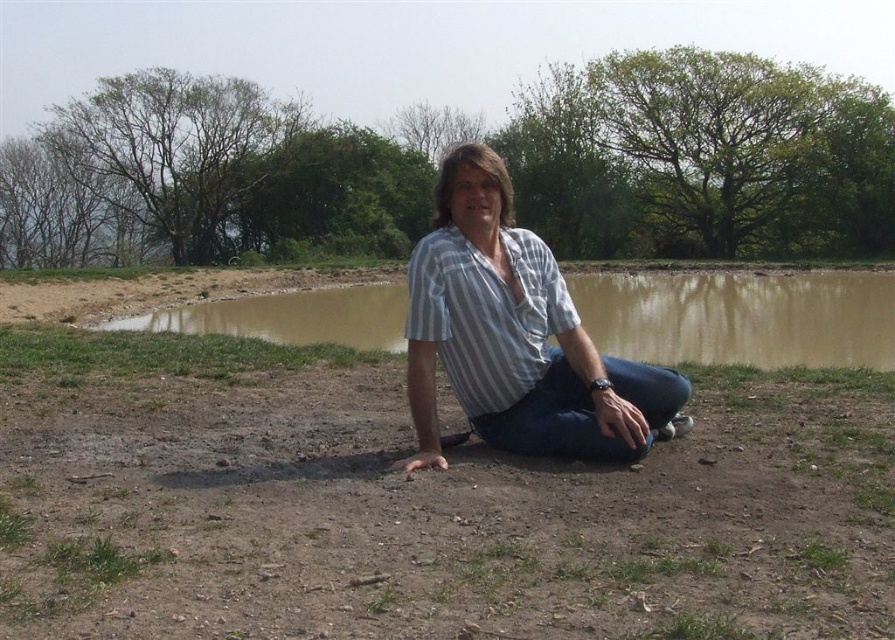
Can you confirm if brown dirt field at center is bigger than striped cotton shirt at center?

Yes.

Is brown dirt field at center to the left of striped cotton shirt at center from the viewer's perspective?

Correct, you'll find brown dirt field at center to the left of striped cotton shirt at center.

Does point (365, 461) come farther from viewer compared to point (473, 260)?

No, (365, 461) is in front of (473, 260).

Locate an element on the screen. The width and height of the screenshot is (895, 640). brown dirt field at center is located at coordinates (420, 506).

Is striped cotton shirt at center wider than brown muddy water at center?

In fact, striped cotton shirt at center might be narrower than brown muddy water at center.

Is striped cotton shirt at center to the right of brown muddy water at center from the viewer's perspective?

In fact, striped cotton shirt at center is to the left of brown muddy water at center.

Does point (521, 289) come behind point (825, 284)?

That is False.

The height and width of the screenshot is (640, 895). I want to click on striped cotton shirt at center, so tap(516, 337).

Is brown dirt field at center positioned behind brown muddy water at center?

No, it is in front of brown muddy water at center.

Which is above, brown dirt field at center or brown muddy water at center?

brown muddy water at center

Who is more forward, (180, 426) or (329, 314)?

Positioned in front is point (180, 426).

Locate an element on the screen. This screenshot has width=895, height=640. brown dirt field at center is located at coordinates (420, 506).